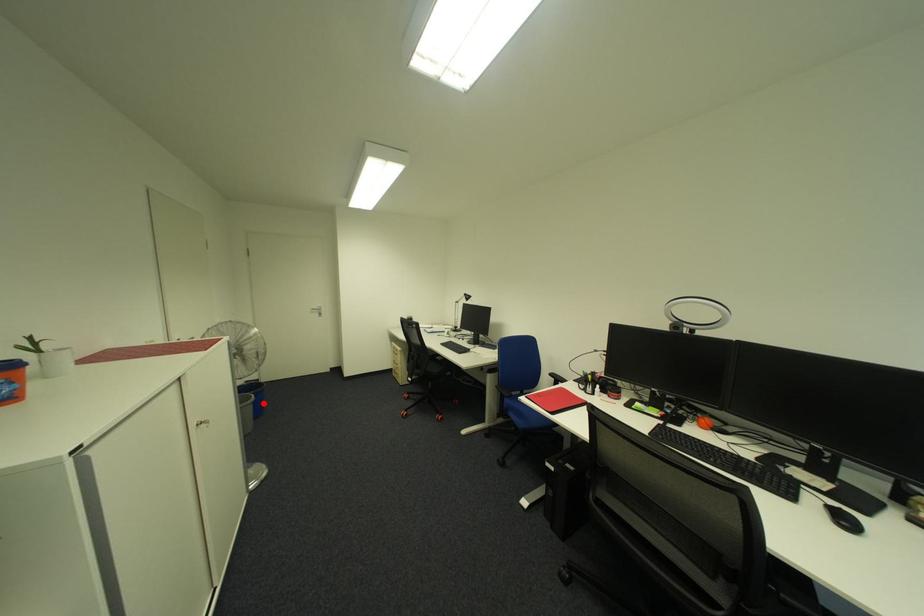
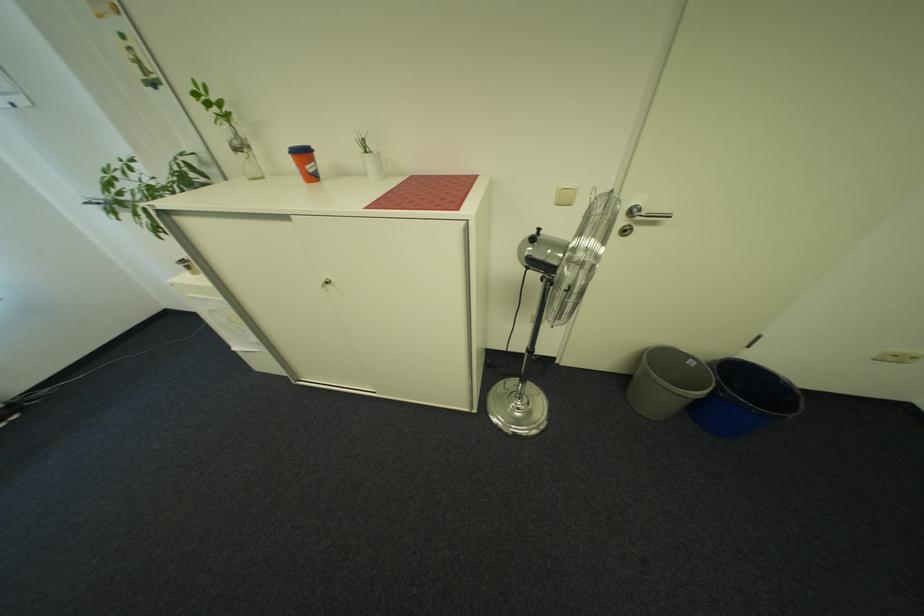
Find the pixel in the second image that matches the highlighted location in the first image.

(707, 403)